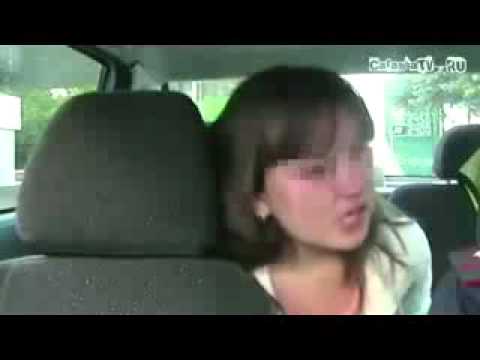
Image resolution: width=480 pixels, height=360 pixels. I want to click on headrest, so click(x=155, y=140).